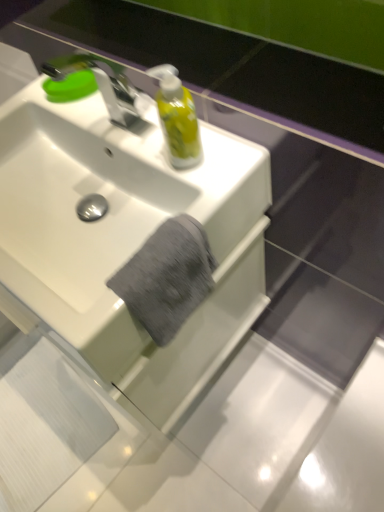
Question: Looking at the image, does white glossy sink at center seem bigger or smaller compared to gray cotton towel at center?

Choices:
 (A) big
 (B) small

Answer: (A)

Question: From the image's perspective, relative to gray cotton towel at center, is white glossy sink at center above or below?

Choices:
 (A) above
 (B) below

Answer: (A)

Question: Which object is positioned farthest from the gray cotton towel at center?

Choices:
 (A) white glossy sink at center
 (B) translucent yellow liquid at upper center
 (C) green matte soap at upper left
 (D) silver metallic faucet at upper left

Answer: (C)

Question: Which object is positioned farthest from the translucent yellow liquid at upper center?

Choices:
 (A) white glossy sink at center
 (B) green matte soap at upper left
 (C) gray cotton towel at center
 (D) silver metallic faucet at upper left

Answer: (B)